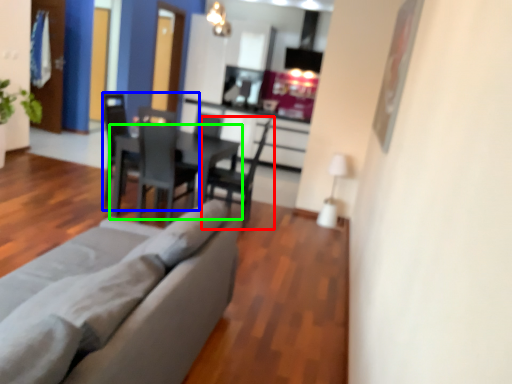
Question: Which object is positioned farthest from chair (highlighted by a red box)? Select from chair (highlighted by a blue box) and table (highlighted by a green box).

Choices:
 (A) chair
 (B) table

Answer: (A)